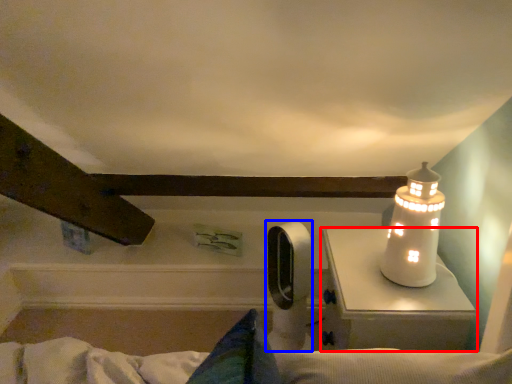
Question: Which point is closer to the camera, table (highlighted by a red box) or equipment (highlighted by a blue box)?

Choices:
 (A) table
 (B) equipment

Answer: (A)